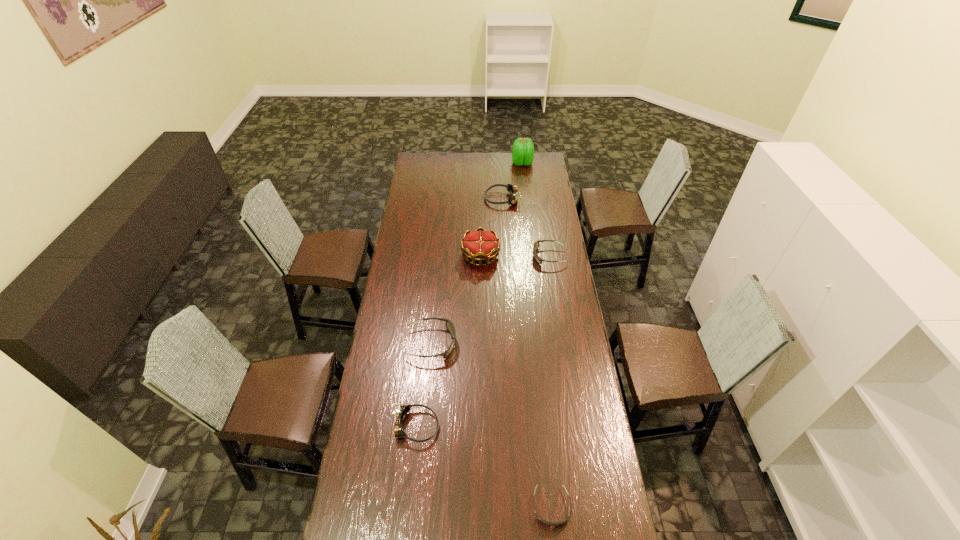
Identify which object is the fourth closest to the third nearest object. Please provide its 2D coordinates. Your answer should be formatted as a tuple, i.e. [(x, y)], where the tuple contains the x and y coordinates of a point satisfying the conditions above.

[(542, 520)]

This screenshot has width=960, height=540. In order to click on object that is the nearest to the shortest object in this screenshot , I will do `click(402, 411)`.

I want to click on goggles identified as the fifth closest to the crown, so click(x=542, y=520).

The width and height of the screenshot is (960, 540). Identify the location of goggles that is the fourth closest to the second farthest goggles. (542, 520).

The height and width of the screenshot is (540, 960). I want to click on the closest bronze goggles to the leftmost black goggles, so click(x=402, y=411).

Where is `bronze goggles that is the closest to the bell pepper`? The height and width of the screenshot is (540, 960). bronze goggles that is the closest to the bell pepper is located at coordinates (512, 189).

At what (x,y) coordinates should I click in order to perform the action: click on black goggles that is the third closest to the fourth farthest goggles. Please return your answer as a coordinate pair (x, y). This screenshot has width=960, height=540. Looking at the image, I should click on (536, 245).

You are a GUI agent. You are given a task and a screenshot of the screen. Output one action in this format:
    pyautogui.click(x=<x>, y=<y>)
    Task: Click on the closest black goggles to the second biggest black goggles
    Image resolution: width=960 pixels, height=540 pixels.
    Given the screenshot: What is the action you would take?
    pyautogui.click(x=449, y=325)

Identify the location of free location that satisfies the following two spatial constraints: 1. on the lenses of the farthest black goggles; 2. on the lenses of the shortest goggles. (588, 507).